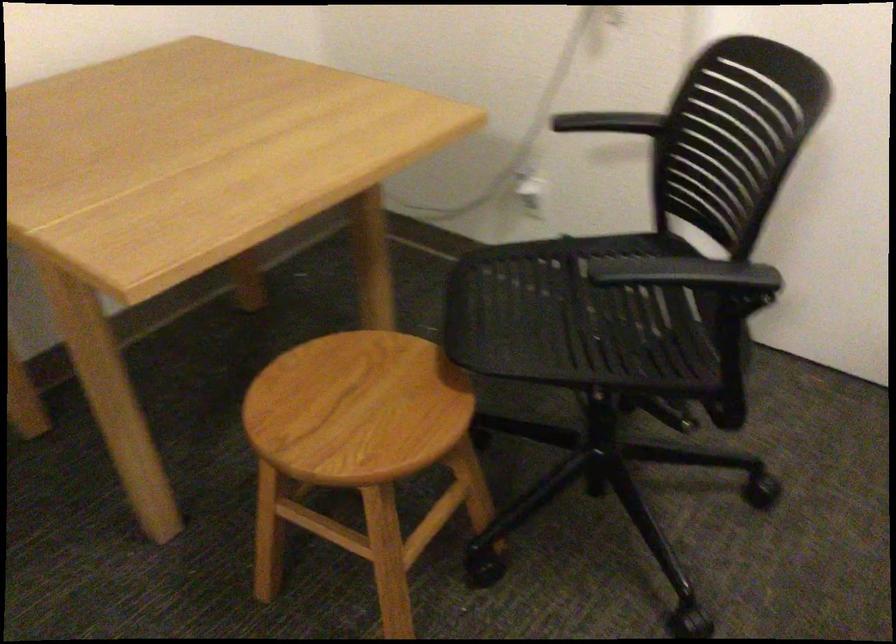
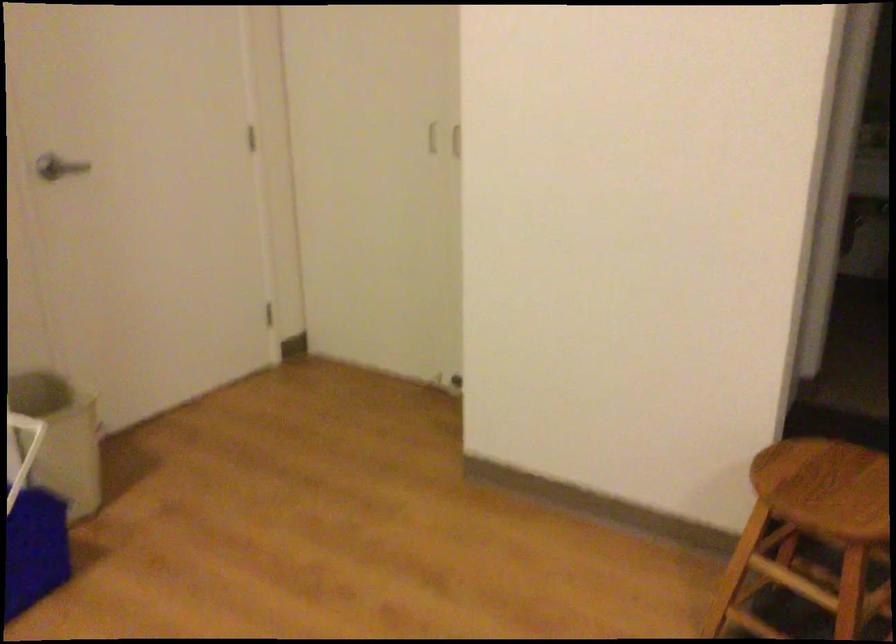
How did the camera likely rotate?

The rotation direction of the camera is left-down.